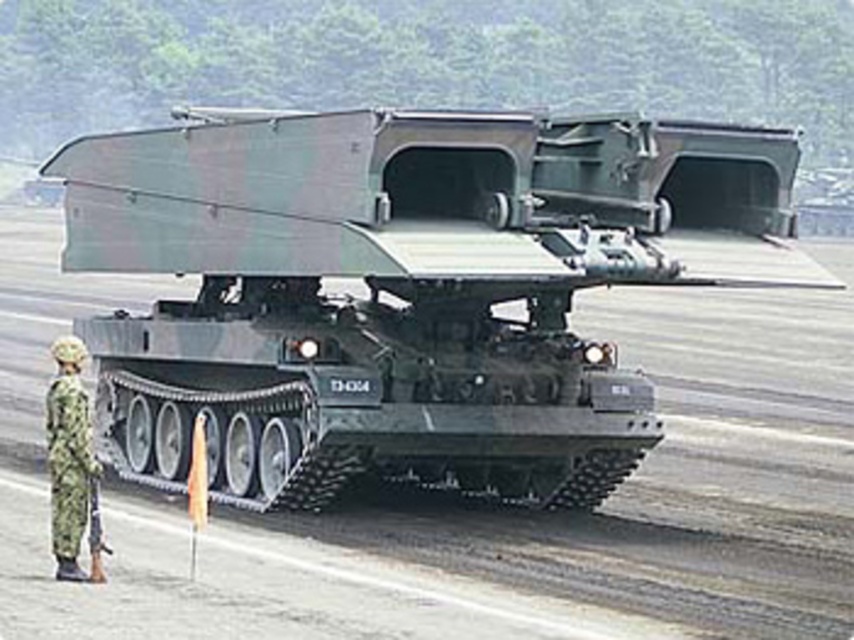
Question: Which object is farther from the camera taking this photo?

Choices:
 (A) camouflage matte tank at center
 (B) camouflage fabric uniform at lower left

Answer: (A)

Question: Among these objects, which one is farthest from the camera?

Choices:
 (A) camouflage matte tank at center
 (B) camouflage fabric uniform at lower left

Answer: (A)

Question: Is camouflage matte tank at center in front of camouflage fabric uniform at lower left?

Choices:
 (A) no
 (B) yes

Answer: (A)

Question: Is camouflage matte tank at center bigger than camouflage fabric uniform at lower left?

Choices:
 (A) yes
 (B) no

Answer: (A)

Question: Is camouflage matte tank at center bigger than camouflage fabric uniform at lower left?

Choices:
 (A) yes
 (B) no

Answer: (A)

Question: Among these objects, which one is nearest to the camera?

Choices:
 (A) camouflage matte tank at center
 (B) camouflage fabric uniform at lower left

Answer: (B)